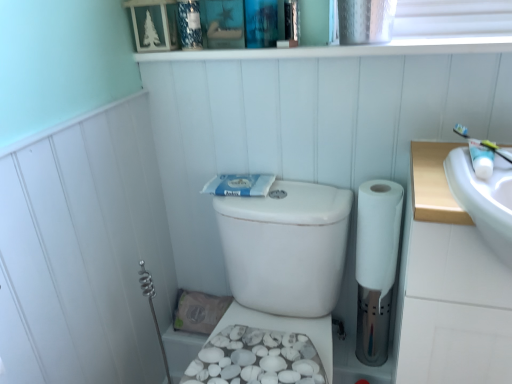
Identify the location of vacant area located to the right-hand side of blue textured candle at upper center, the first toiletry viewed from the top. (237, 48).